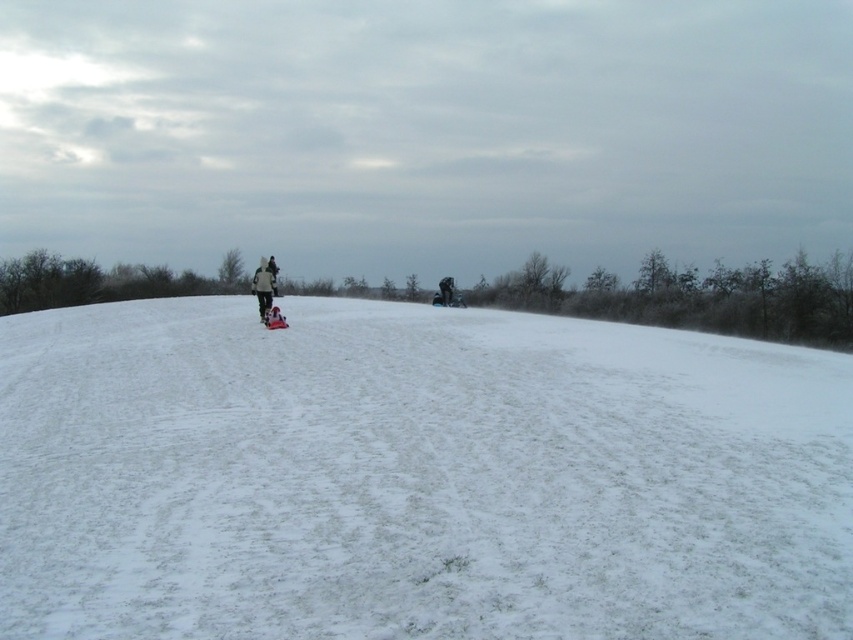
You are standing in the snowy landscape and see the white fluffy snow at center and the dark gray fleece jacket at center. Which object is lower in position?

The white fluffy snow at center is below dark gray fleece jacket at center, so the snow is lower than the jacket.

You are standing in the snowy landscape and want to place a small snowman exactly between the white fluffy snow at center and the dark gray fleece jacket at center. Which direction should you move from the jacket to reach the snow before building the snowman?

To place the snowman between the white fluffy snow at center and the dark gray fleece jacket at center, you should move to the right from the dark gray fleece jacket at center since the white fluffy snow at center is located to its right.

You are a photographer trying to capture a photo of the two figures walking in the snowy landscape. You want to ensure that both the white fluffy snow at center and the dark gray fleece jacket at center are clearly visible in the photo. Which object should you focus on to ensure proper exposure?

The dark gray fleece jacket at center is taller than the white fluffy snow at center, so focusing on the jacket would help balance the exposure since it is a darker object against the snowy background.